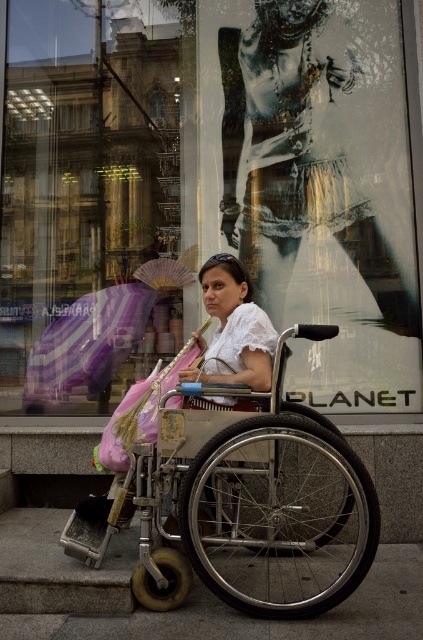
You are a fashion designer observing the storefront window advertisement. You see the metallic silver dress at center and the striped fabric umbrella at left. Which object is wider?

The metallic silver dress at center is wider than the striped fabric umbrella at left.

You are a delivery person who needs to place a small package at the location marked by point (178, 620) and another package at point (63, 356). Based on the scene, which point is closer to the storefront window?

Point (178, 620) is in front of point (63, 356), so it is closer to the storefront window.

You are a pedestrian trying to cross the street and see the silver metallic wheelchair at center and the striped fabric umbrella at left. Which object is nearer to you?

The silver metallic wheelchair at center is closer to the viewer than the striped fabric umbrella at left.